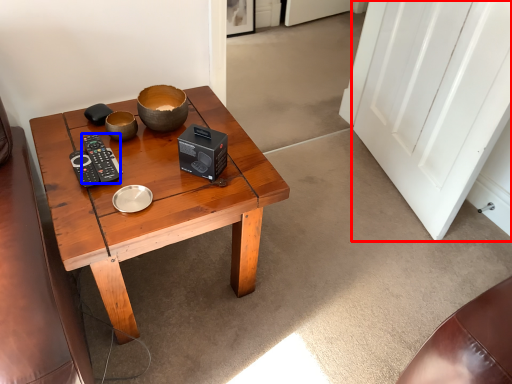
Question: Which point is closer to the camera, door (highlighted by a red box) or control (highlighted by a blue box)?

Choices:
 (A) door
 (B) control

Answer: (A)